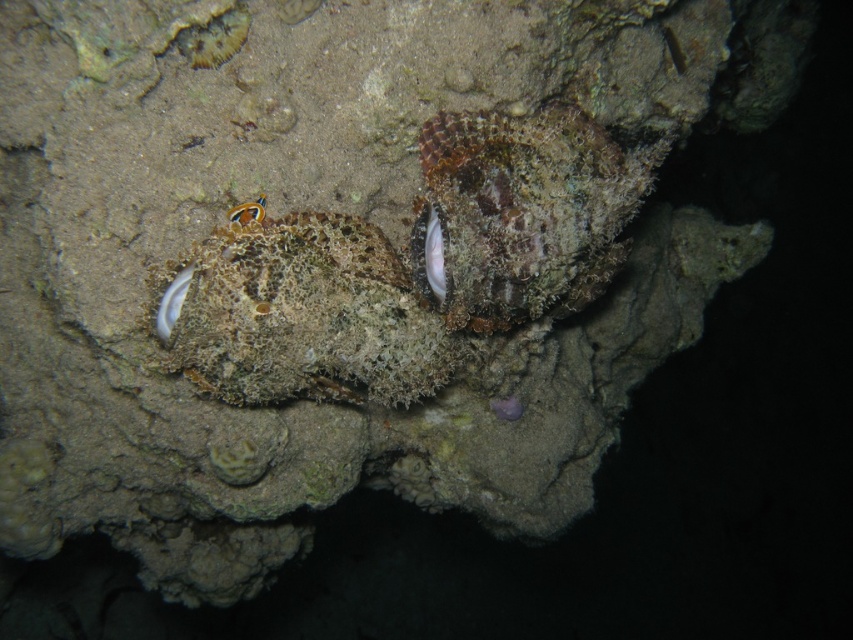
Question: Is camouflage-patterned stonefish at center closer to the viewer compared to orange coral at center?

Choices:
 (A) no
 (B) yes

Answer: (B)

Question: Which object is farther from the camera taking this photo?

Choices:
 (A) orange coral at center
 (B) camouflage-patterned stonefish at center

Answer: (A)

Question: Which point appears farthest from the camera in this image?

Choices:
 (A) (238, 205)
 (B) (549, 259)

Answer: (A)

Question: Can you confirm if camouflage-patterned stonefish at center is wider than orange coral at center?

Choices:
 (A) no
 (B) yes

Answer: (B)

Question: Can you confirm if camouflage-patterned stonefish at center is thinner than orange coral at center?

Choices:
 (A) no
 (B) yes

Answer: (A)